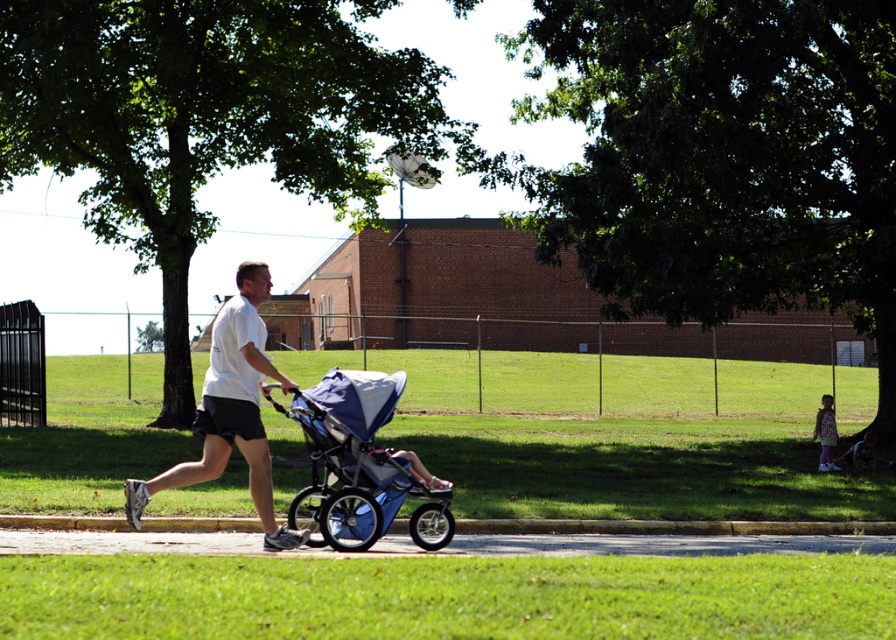
You are standing at the point with coordinates point (240,440) and want to walk to the point with coordinates point (825,433). Which direction should you face to walk towards your destination?

You should face north because point (240,440) is in front of point (825,433), indicating that the destination is north of your current position.

Looking at this image, you are a photographer standing in the park. You want to take a picture of the white matte shirt at center and the pastel pink dress at lower right. Which object should you zoom in on to make them appear the same size in the photo?

You should zoom in on the pastel pink dress at lower right because the white matte shirt at center is bigger than the pastel pink dress at lower right. By zooming in on the smaller object, you can make both appear the same size in the photo.